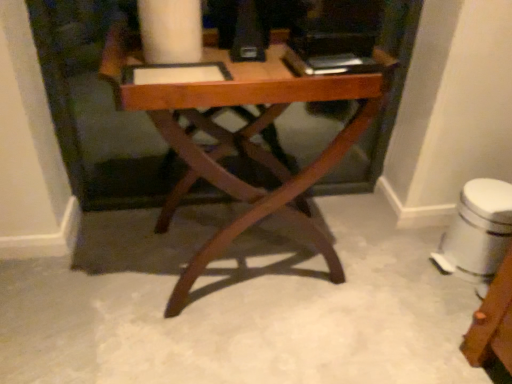
Locate an element on the screen. wooden table at center is located at coordinates (243, 139).

In order to face wooden table at center, should I rotate leftwards or rightwards?

Turn left by 2.443 degrees to look at wooden table at center.

Measure the distance between wooden table at center and camera.

They are 34.37 inches apart.

What do you see at coordinates (243, 139) in the screenshot? The width and height of the screenshot is (512, 384). I see `wooden table at center` at bounding box center [243, 139].

What are the coordinates of `wooden table at center` in the screenshot? It's located at (243, 139).